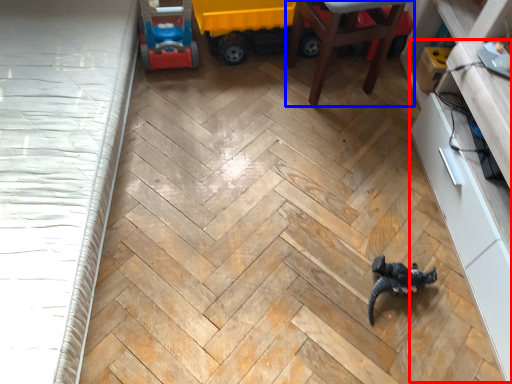
Question: Which point is closer to the camera, dresser (highlighted by a red box) or furniture (highlighted by a blue box)?

Choices:
 (A) dresser
 (B) furniture

Answer: (A)